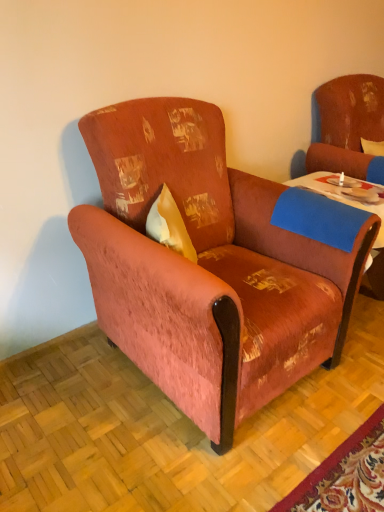
Question: Which direction should I rotate to look at velvet-like rust-colored armchair at center?

Choices:
 (A) right
 (B) left

Answer: (A)

Question: From a real-world perspective, is distressed fabric swivel chair at upper right physically above blue felt table at center?

Choices:
 (A) no
 (B) yes

Answer: (B)

Question: Considering the relative positions of distressed fabric swivel chair at upper right and blue felt table at center in the image provided, is distressed fabric swivel chair at upper right to the right of blue felt table at center from the viewer's perspective?

Choices:
 (A) no
 (B) yes

Answer: (B)

Question: Are distressed fabric swivel chair at upper right and blue felt table at center located far from each other?

Choices:
 (A) no
 (B) yes

Answer: (A)

Question: Are distressed fabric swivel chair at upper right and blue felt table at center beside each other?

Choices:
 (A) yes
 (B) no

Answer: (B)

Question: Is the position of distressed fabric swivel chair at upper right more distant than that of blue felt table at center?

Choices:
 (A) no
 (B) yes

Answer: (B)

Question: Is distressed fabric swivel chair at upper right not within blue felt table at center?

Choices:
 (A) no
 (B) yes

Answer: (B)

Question: Is distressed fabric swivel chair at upper right at the left side of velvet-like rust-colored armchair at center?

Choices:
 (A) no
 (B) yes

Answer: (A)

Question: Considering the relative positions of distressed fabric swivel chair at upper right and velvet-like rust-colored armchair at center in the image provided, is distressed fabric swivel chair at upper right in front of velvet-like rust-colored armchair at center?

Choices:
 (A) no
 (B) yes

Answer: (A)

Question: From the image's perspective, is distressed fabric swivel chair at upper right under velvet-like rust-colored armchair at center?

Choices:
 (A) no
 (B) yes

Answer: (A)

Question: From the image's perspective, is distressed fabric swivel chair at upper right over velvet-like rust-colored armchair at center?

Choices:
 (A) yes
 (B) no

Answer: (A)

Question: Is velvet-like rust-colored armchair at center at the back of distressed fabric swivel chair at upper right?

Choices:
 (A) no
 (B) yes

Answer: (A)

Question: Considering the relative positions of distressed fabric swivel chair at upper right and velvet-like rust-colored armchair at center in the image provided, is distressed fabric swivel chair at upper right to the right of velvet-like rust-colored armchair at center from the viewer's perspective?

Choices:
 (A) no
 (B) yes

Answer: (B)

Question: Is velvet-like rust-colored armchair at center oriented away from distressed fabric swivel chair at upper right?

Choices:
 (A) yes
 (B) no

Answer: (B)